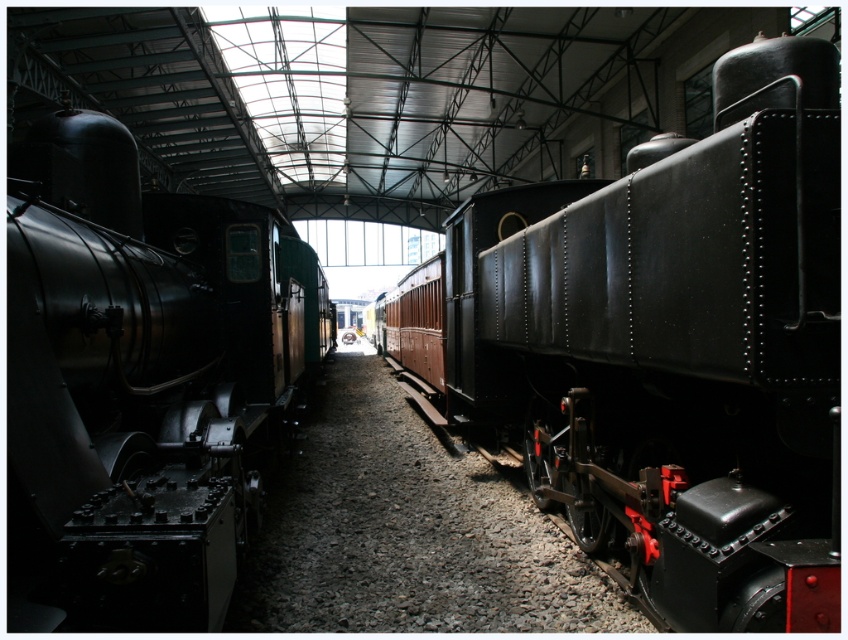
Question: Where is matte black train at center located in relation to polished metal locomotive at left in the image?

Choices:
 (A) above
 (B) below

Answer: (B)

Question: Which point is closer to the camera taking this photo?

Choices:
 (A) (818, 426)
 (B) (7, 563)

Answer: (B)

Question: Which point is farther to the camera?

Choices:
 (A) gray gravel at center
 (B) polished metal locomotive at left
 (C) matte black train at center

Answer: (A)

Question: In this image, where is polished metal locomotive at left located relative to gray gravel at center?

Choices:
 (A) left
 (B) right

Answer: (A)

Question: Which point is farther to the camera?

Choices:
 (A) (540, 556)
 (B) (527, 448)
 (C) (23, 232)

Answer: (B)

Question: Where is matte black train at center located in relation to polished metal locomotive at left in the image?

Choices:
 (A) below
 (B) above

Answer: (A)